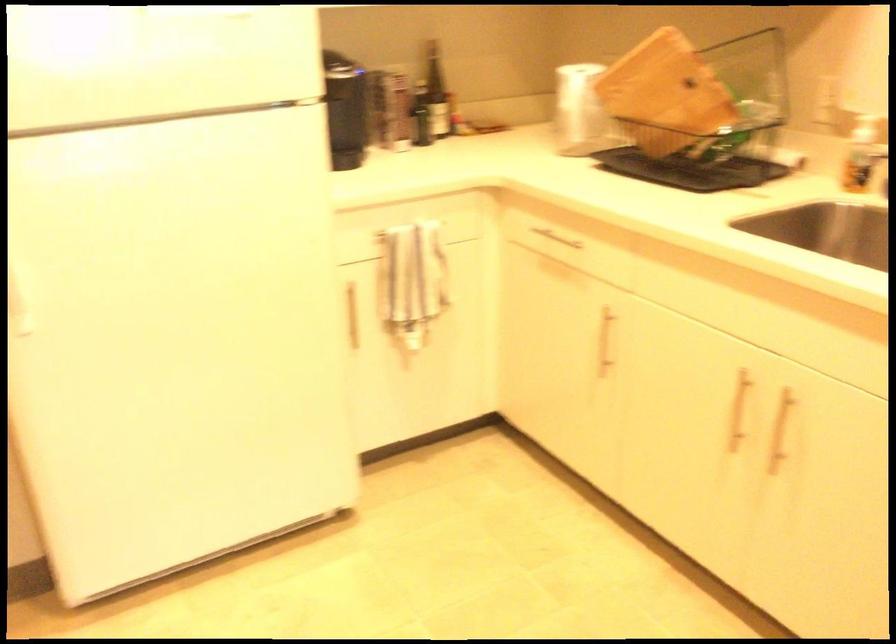
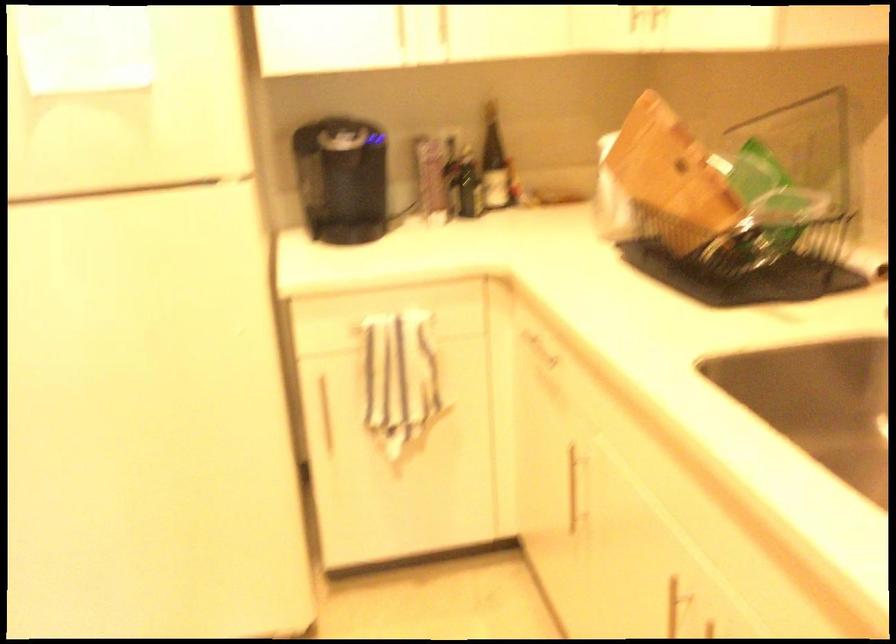
Question: The camera is either moving clockwise (left) or counter-clockwise (right) around the object. The first image is from the beginning of the video and the second image is from the end. Is the camera moving left or right when shooting the video?

Choices:
 (A) Left
 (B) Right

Answer: (B)